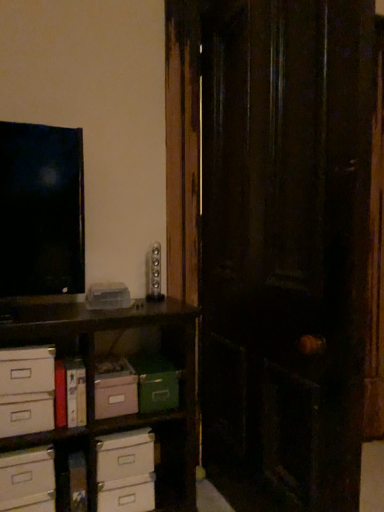
Where is `vacant area on top of green matte storage box at center, the second storage box when ordered from left to right (from a real-world perspective)`? vacant area on top of green matte storage box at center, the second storage box when ordered from left to right (from a real-world perspective) is located at coordinates tap(147, 359).